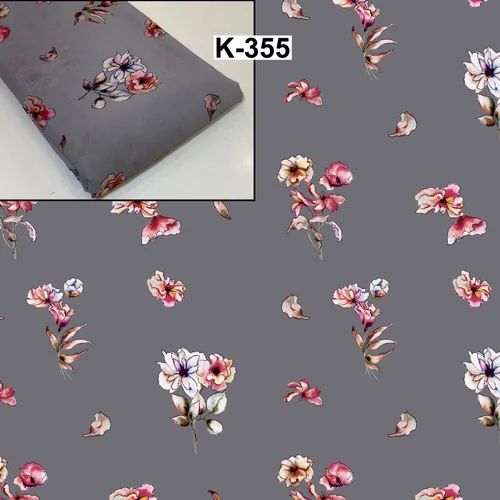
Identify the location of fabric roll. Image resolution: width=500 pixels, height=500 pixels. (152, 118).